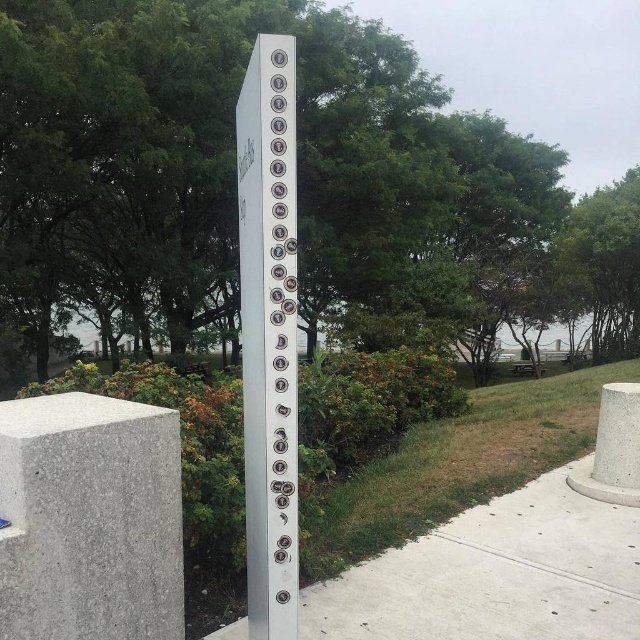
You are a park visitor who wants to know the height of the gray concrete at lower left and the silver metallic pole at center. Which one is taller?

The silver metallic pole at center is taller than the gray concrete at lower left.